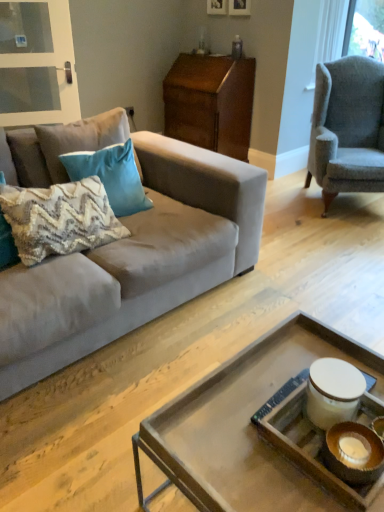
Question: From a real-world perspective, is clear glass screen door at upper left physically located above or below teal velvet pillow at upper left, which ranks as the 2th pillow in front-to-back order?

Choices:
 (A) below
 (B) above

Answer: (B)

Question: Is clear glass screen door at upper left bigger or smaller than teal velvet pillow at upper left, placed as the second pillow when sorted from back to front?

Choices:
 (A) small
 (B) big

Answer: (A)

Question: Considering the real-world distances, which object is closest to the wooden picture frame at upper center, which appears as the 1th picture frame when viewed from the left?

Choices:
 (A) textured cotton pillow at center, placed as the 1th pillow when sorted from back to front
 (B) wooden tray at center
 (C) teal velvet pillow at upper left, which ranks as the 2th pillow in front-to-back order
 (D) wooden nightstand at upper center
 (E) matte brown tray at center

Answer: (D)

Question: Estimate the real-world distances between objects in this image. Which object is farther from the textured cotton pillow at center, which is counted as the third pillow, starting from the front?

Choices:
 (A) clear glass screen door at upper left
 (B) suede couch at left
 (C) matte brown tray at center
 (D) wooden picture frame at upper center, placed as the second picture frame when sorted from right to left
 (E) wooden picture frame at upper center, which is the 2th picture frame in left-to-right order

Answer: (D)